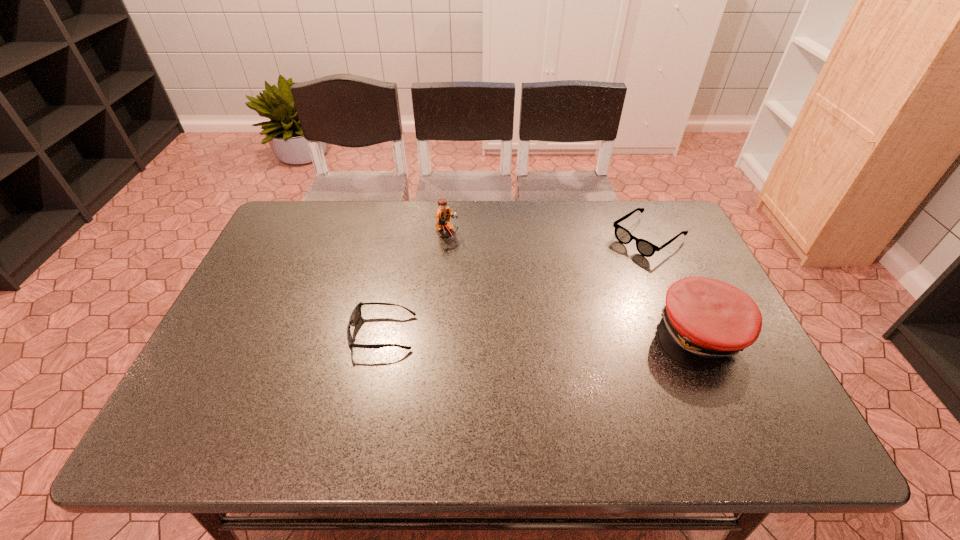
At what (x,y) coordinates should I click in order to perform the action: click on empty space that is in between the second object from left to right and the cap. Please return your answer as a coordinate pair (x, y). Looking at the image, I should click on (573, 284).

Where is `free point between the shortest object and the second object from left to right`? free point between the shortest object and the second object from left to right is located at coordinates (415, 283).

Where is `object that can be found as the closest to the third tallest object`? object that can be found as the closest to the third tallest object is located at coordinates (705, 321).

Find the location of a particular element. This screenshot has width=960, height=540. object that ranks as the closest to the second shortest object is located at coordinates (705, 321).